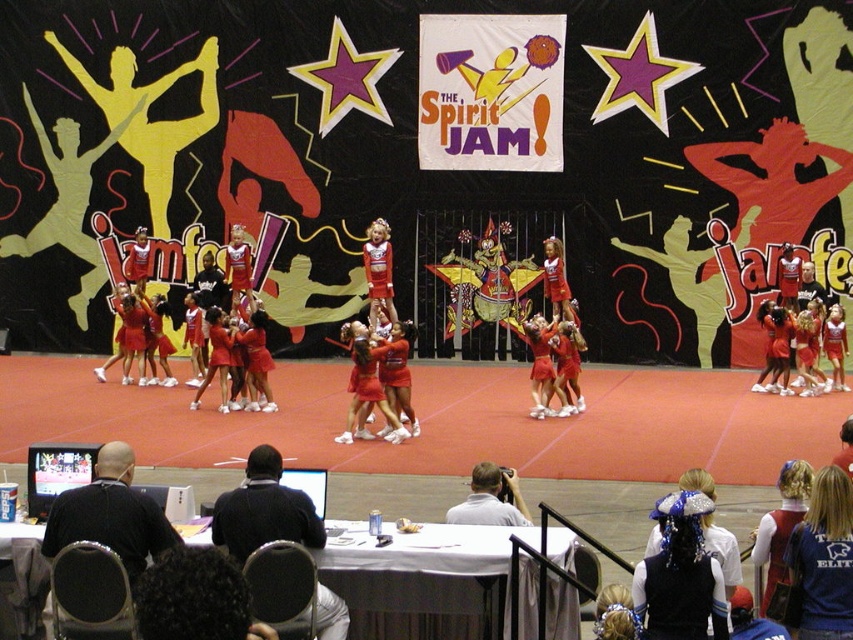
You are a photographer at the event and want to capture a photo where both the dark curly hair at lower left and the black shirt at center are visible. Based on their heights, which object should you focus on to ensure both are in frame?

Since the dark curly hair at lower left is shorter than the black shirt at center, you should focus on the black shirt at center to ensure both are visible in the frame.

Looking at this image, you are a photographer at the event and want to capture a photo where both the dark curly hair at lower left and the black shirt at center are visible. Given their sizes, which object should you focus on to ensure both are in frame without zooming in or out?

The dark curly hair at lower left is thinner than the black shirt at center, so focusing on the black shirt at center would allow both to be in frame since it is larger and can be positioned centrally while the smaller dark curly hair at lower left remains visible in the lower left portion of the photo.

You are standing in the audience watching the cheerleading performance at The Spirit Jam. You want to toss a flower bouquet to the blue jersey at center. If you can throw up to 20 feet, will you be able to reach them?

The blue jersey at center and viewer are 21.08 feet apart. Since the viewer can only throw up to 20 feet, they cannot reach the blue jersey at center.